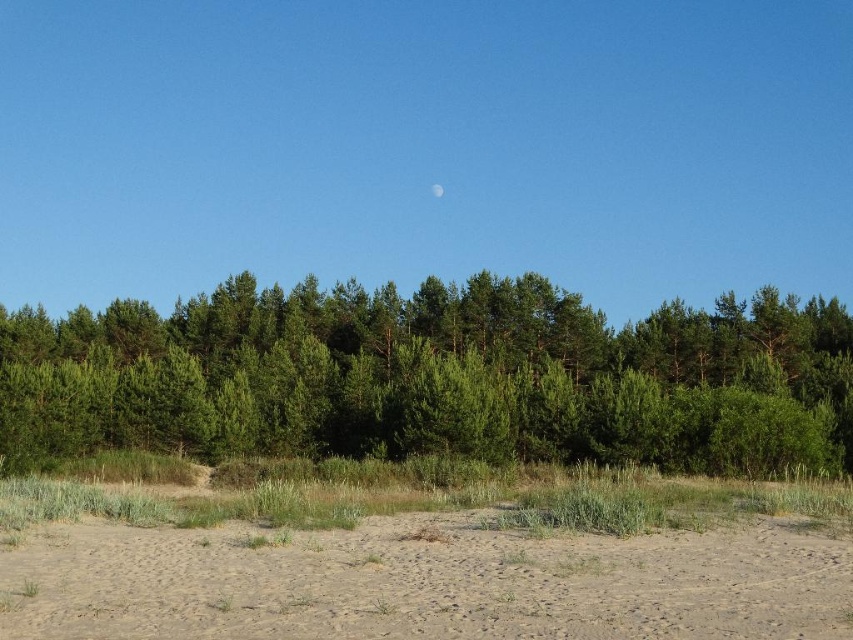
You are a hiker who wants to cross the brown sandy dirt at lower center to reach the green leafy forest at center. Based on the scene description, can you walk directly from the sandy dirt to the forest without any obstacles?

The brown sandy dirt at lower center is behind the green leafy forest at center, so you cannot walk directly from the sandy dirt to the forest without going around or through the forest itself.

You are standing in the natural landscape and want to walk from the point closer to you to the point further away. Which path would you take between the two points, point (376, 547) and point (436, 192)?

You should take the path from point (376, 547) to point (436, 192) since point (376, 547) is closer to the viewer and you want to move towards the point further away.